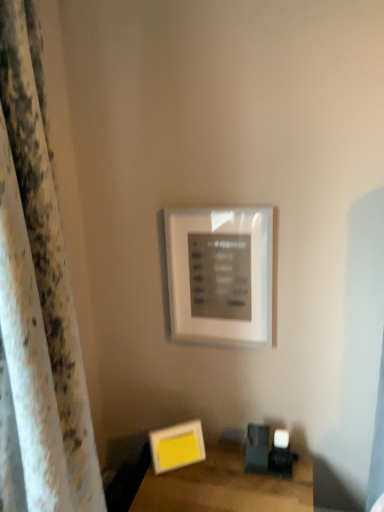
Question: Can you confirm if yellow matte picture frame at lower center, marked as the second picture frame in a top-to-bottom arrangement, is smaller than white matte picture frame at upper center, which appears as the 2th picture frame when ordered from the bottom?

Choices:
 (A) yes
 (B) no

Answer: (A)

Question: Could you tell me if yellow matte picture frame at lower center, marked as the second picture frame in a top-to-bottom arrangement, is turned towards white matte picture frame at upper center, which appears as the 2th picture frame when ordered from the bottom?

Choices:
 (A) no
 (B) yes

Answer: (A)

Question: Is yellow matte picture frame at lower center, marked as the second picture frame in a top-to-bottom arrangement, thinner than white matte picture frame at upper center, which appears as the 2th picture frame when ordered from the bottom?

Choices:
 (A) no
 (B) yes

Answer: (A)

Question: Is yellow matte picture frame at lower center, marked as the second picture frame in a top-to-bottom arrangement, turned away from white matte picture frame at upper center, placed as the first picture frame when sorted from top to bottom?

Choices:
 (A) yes
 (B) no

Answer: (B)

Question: From a real-world perspective, is yellow matte picture frame at lower center, the 1th picture frame from the bottom, over white matte picture frame at upper center, which appears as the 2th picture frame when ordered from the bottom?

Choices:
 (A) yes
 (B) no

Answer: (B)

Question: Looking at the image, does white textured curtain at left seem bigger or smaller compared to yellow matte picture frame at lower center, the 1th picture frame from the bottom?

Choices:
 (A) big
 (B) small

Answer: (A)

Question: In the image, is white textured curtain at left positioned in front of or behind yellow matte picture frame at lower center, marked as the second picture frame in a top-to-bottom arrangement?

Choices:
 (A) behind
 (B) front

Answer: (B)

Question: Does point (54, 367) appear closer or farther from the camera than point (157, 453)?

Choices:
 (A) farther
 (B) closer

Answer: (B)

Question: From the image's perspective, is white textured curtain at left above or below yellow matte picture frame at lower center, marked as the second picture frame in a top-to-bottom arrangement?

Choices:
 (A) above
 (B) below

Answer: (A)

Question: Does point (145, 484) appear closer or farther from the camera than point (256, 289)?

Choices:
 (A) closer
 (B) farther

Answer: (A)

Question: From the image's perspective, relative to white matte picture frame at upper center, which appears as the 2th picture frame when ordered from the bottom, is wooden table at lower right above or below?

Choices:
 (A) above
 (B) below

Answer: (B)

Question: Would you say wooden table at lower right is inside or outside white matte picture frame at upper center, which appears as the 2th picture frame when ordered from the bottom?

Choices:
 (A) outside
 (B) inside

Answer: (A)

Question: In terms of width, does wooden table at lower right look wider or thinner when compared to white matte picture frame at upper center, placed as the first picture frame when sorted from top to bottom?

Choices:
 (A) thin
 (B) wide

Answer: (B)

Question: From the image's perspective, is white textured curtain at left above or below wooden table at lower right?

Choices:
 (A) below
 (B) above

Answer: (B)

Question: From a real-world perspective, is white textured curtain at left physically located above or below wooden table at lower right?

Choices:
 (A) above
 (B) below

Answer: (A)